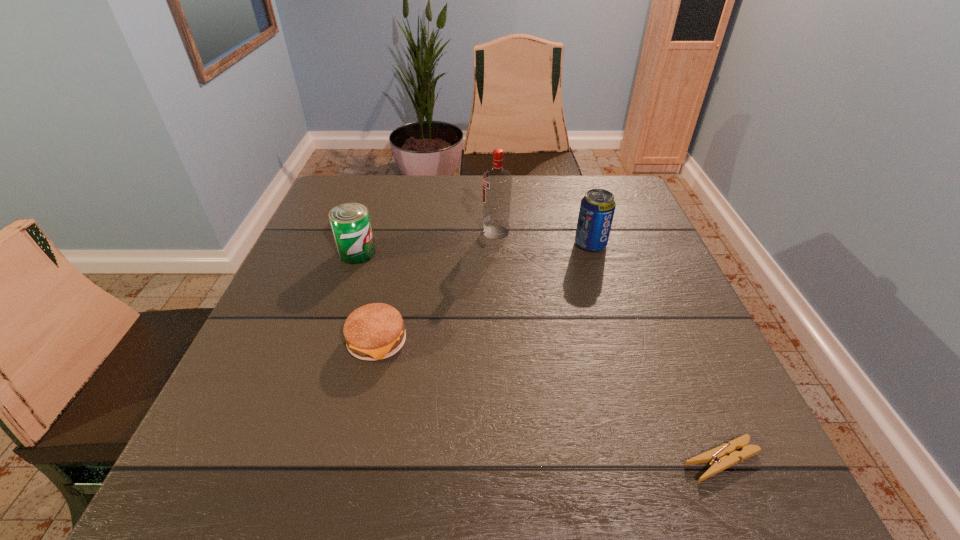
What are the coordinates of `vodka` in the screenshot? It's located at (497, 182).

The height and width of the screenshot is (540, 960). Identify the location of the tallest object. (497, 182).

Identify the location of the second tallest object. This screenshot has width=960, height=540. (597, 207).

Locate an element on the screen. the third shortest object is located at coordinates (350, 222).

Identify the location of the fourth farthest object. (376, 331).

I want to click on the second shortest object, so coord(376,331).

The width and height of the screenshot is (960, 540). What are the coordinates of `the shortest object` in the screenshot? It's located at (722, 457).

Locate an element on the screen. the nearest object is located at coordinates (722, 457).

Where is `vacant space located 0.120m on the front label of the tallest object`? This screenshot has height=540, width=960. vacant space located 0.120m on the front label of the tallest object is located at coordinates point(435,232).

At what (x,y) coordinates should I click in order to perform the action: click on vacant space situated on the front label of the tallest object. Please return your answer as a coordinate pair (x, y). This screenshot has height=540, width=960. Looking at the image, I should click on (346, 232).